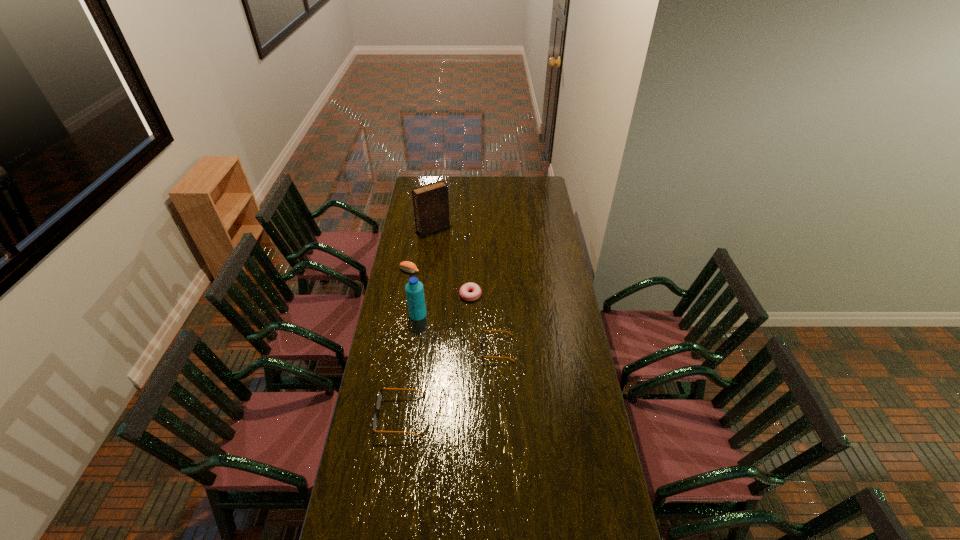
Where is `vacant spot to place a spectacles on the right`? The image size is (960, 540). vacant spot to place a spectacles on the right is located at coordinates tap(573, 296).